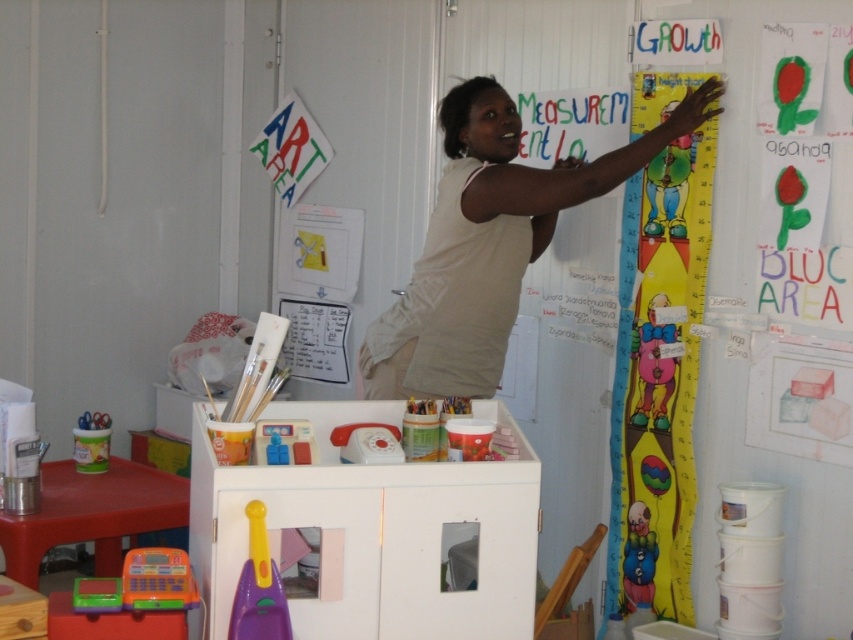
Which of these two, cartoon paper height chart at upper right or rubberized plastic cash register at lower left, stands taller?

With more height is cartoon paper height chart at upper right.

What are the coordinates of `cartoon paper height chart at upper right` in the screenshot? It's located at (657, 378).

Based on the photo, can you confirm if rubberized plastic toy at lower left is wider than matte plastic clown at lower right?

Correct, the width of rubberized plastic toy at lower left exceeds that of matte plastic clown at lower right.

Is rubberized plastic toy at lower left bigger than matte plastic clown at lower right?

No, rubberized plastic toy at lower left is not bigger than matte plastic clown at lower right.

Where is `rubberized plastic toy at lower left`? The image size is (853, 640). rubberized plastic toy at lower left is located at coordinates (258, 588).

Which is above, beige fabric at upper center or rubberized plastic cash register at lower left?

beige fabric at upper center is above.

Is beige fabric at upper center below rubberized plastic cash register at lower left?

No.

Who is more forward, [402,316] or [177,604]?

Point [177,604] is more forward.

Identify the location of beige fabric at upper center. (489, 243).